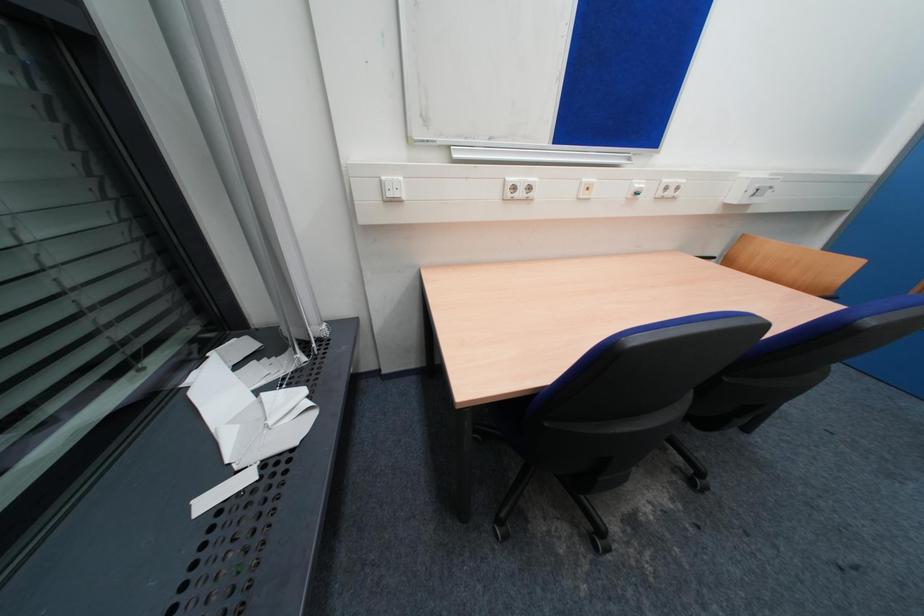
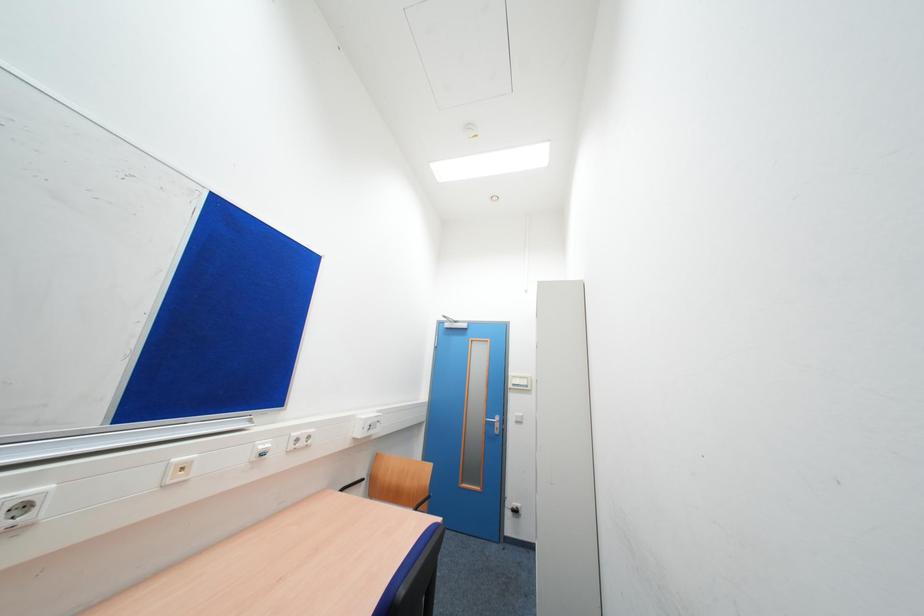
Based on the continuous images, in which direction is the camera rotating?

The camera rotated toward right-up.